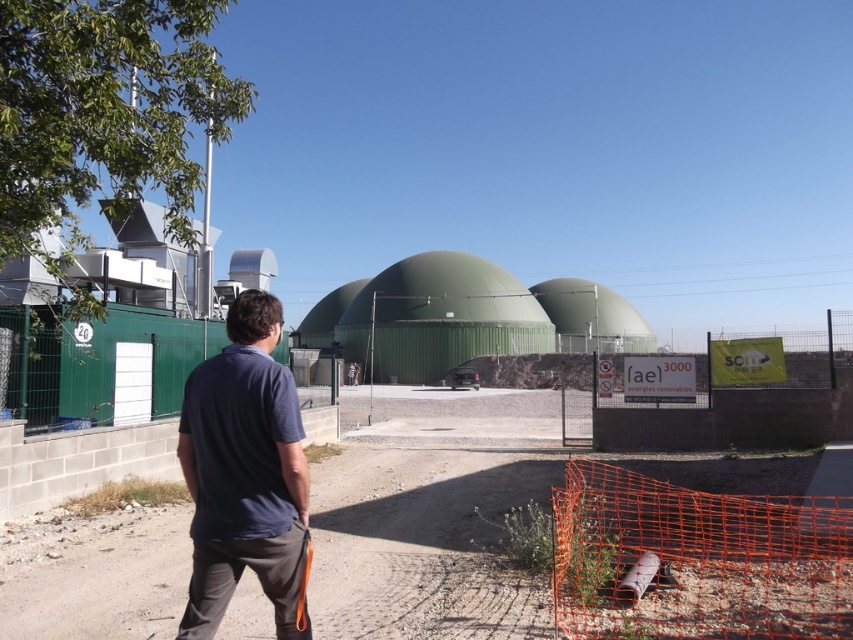
You are a delivery driver who needs to park your truck on the dirt track at lower center. Your truck is 1.5 meters wide. Can you park your truck there without overlapping the dark blue cotton shirt at center?

The dirt track at lower center is wider than the dark blue cotton shirt at center, so yes, the truck can park there as the track is wide enough to accommodate the truck without overlapping the shirt.

You are standing at the point marked by the coordinates point (422, 544) in the image. Looking around, you see a man in dark blue shirt and gray pants observing the scene. Which direction should you walk to reach the nearest vegetation?

The vegetation is located near the bottom right corner of the image. Since you are at the point marked by the coordinates point (422, 544), you should walk towards the bottom right direction to reach the nearest vegetation.

You are standing at the point with coordinates point (273, 339) and want to walk to the point with coordinates point (126, 548). Based on the scene description, will you be moving towards the foreground or the background?

The point (126, 548) is behind point (273, 339), so moving from point (273, 339) to point (126, 548) means you are moving towards the background.